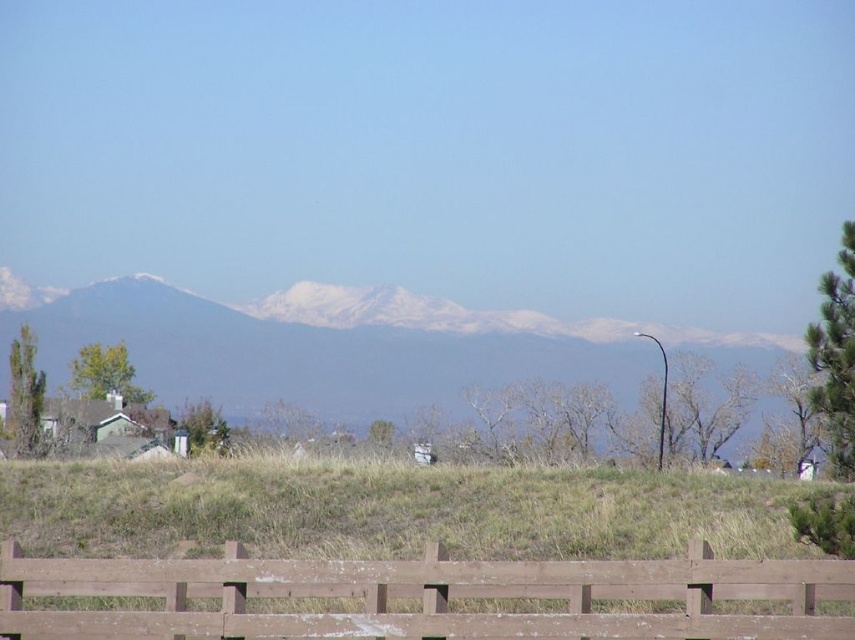
You are standing at the base of the green grassy hill at center and want to reach the snowy white mountains at center. Which direction should you go to ascend towards the mountains?

The green grassy hill at center has a lesser height compared to snowy white mountains at center, so you should ascend towards the snowy white mountains at center which are taller than the hill.

You are planning to install a new garden in your backyard. You have a limited space and need to know which object takes up more area between the green grassy hill at center and the brown wooden fence at lower center. Which one is larger?

The green grassy hill at center is larger in size than the brown wooden fence at lower center, so it occupies more area.